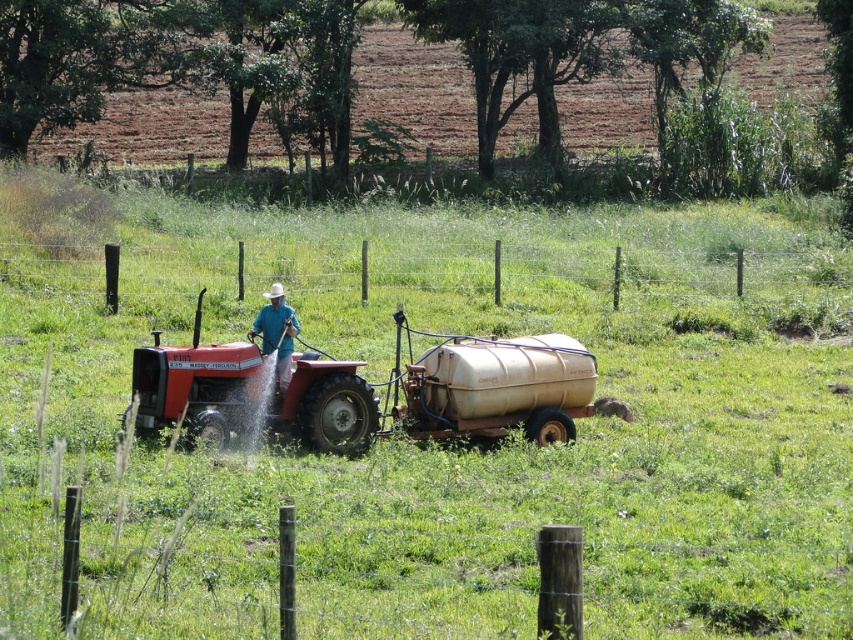
Question: Can you confirm if green grass at center is positioned below matte red tractor at center?

Choices:
 (A) yes
 (B) no

Answer: (B)

Question: Which of the following is the closest to the observer?

Choices:
 (A) (289, 433)
 (B) (541, 484)

Answer: (B)

Question: Among these objects, which one is farthest from the camera?

Choices:
 (A) matte red tractor at center
 (B) green grass at center

Answer: (A)

Question: Is green grass at center smaller than matte red tractor at center?

Choices:
 (A) no
 (B) yes

Answer: (A)

Question: Which of the following is the closest to the observer?

Choices:
 (A) (343, 419)
 (B) (845, 576)

Answer: (B)

Question: Can you confirm if green grass at center is bigger than matte red tractor at center?

Choices:
 (A) no
 (B) yes

Answer: (B)